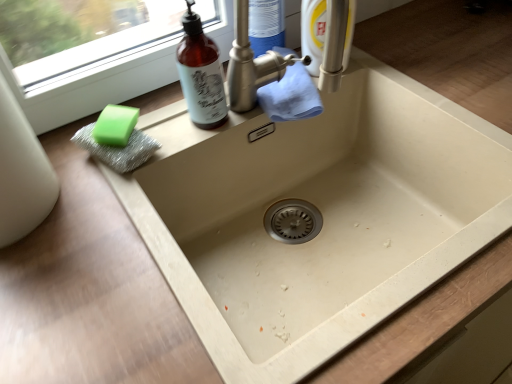
Question: From their relative heights in the image, would you say green sponge at left is taller or shorter than brown glass bottle at upper left?

Choices:
 (A) short
 (B) tall

Answer: (A)

Question: Is green sponge at left inside or outside of brown glass bottle at upper left?

Choices:
 (A) inside
 (B) outside

Answer: (B)

Question: Would you say green sponge at left is to the left or to the right of brown glass bottle at upper left in the picture?

Choices:
 (A) right
 (B) left

Answer: (B)

Question: Is brown glass bottle at upper left inside or outside of green sponge at left?

Choices:
 (A) inside
 (B) outside

Answer: (B)

Question: In terms of height, does brown glass bottle at upper left look taller or shorter compared to green sponge at left?

Choices:
 (A) short
 (B) tall

Answer: (B)

Question: In terms of width, does brown glass bottle at upper left look wider or thinner when compared to green sponge at left?

Choices:
 (A) wide
 (B) thin

Answer: (B)

Question: In the image, is brown glass bottle at upper left positioned in front of or behind green sponge at left?

Choices:
 (A) front
 (B) behind

Answer: (A)